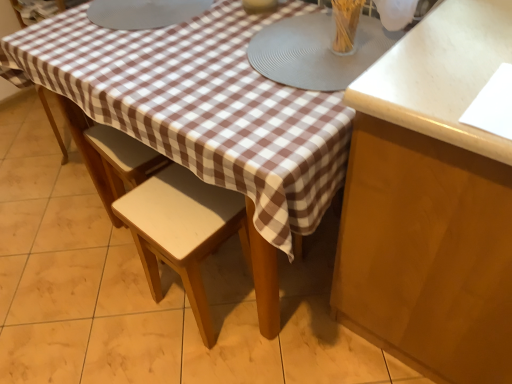
Find the location of a particular element. vacant space to the right of light beige wood stool at center is located at coordinates (296, 307).